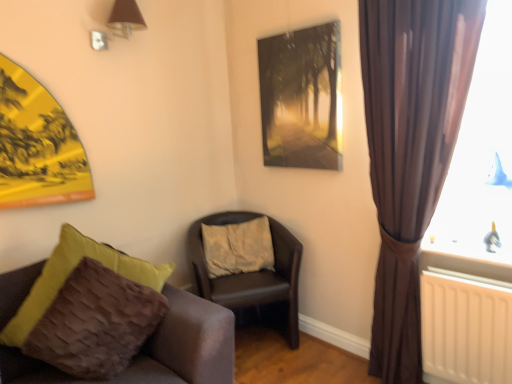
The width and height of the screenshot is (512, 384). What do you see at coordinates (125, 18) in the screenshot? I see `matte brown lampshade at upper left` at bounding box center [125, 18].

Measure the distance between matte brown lampshade at upper left and camera.

matte brown lampshade at upper left and camera are 2.14 meters apart from each other.

Where is `brown textured cushion at lower left, which is counted as the 1th chair, starting from the front`? The image size is (512, 384). brown textured cushion at lower left, which is counted as the 1th chair, starting from the front is located at coordinates (186, 344).

Where is `matte brown lampshade at upper left`? The image size is (512, 384). matte brown lampshade at upper left is located at coordinates (125, 18).

Which object is wider, beige fabric pillow at center or brown textured cushion at lower left, which appears as the 2th chair when viewed from the back?

brown textured cushion at lower left, which appears as the 2th chair when viewed from the back, is wider.

Between beige fabric pillow at center and brown textured cushion at lower left, which is counted as the 1th chair, starting from the front, which one has more height?

With more height is brown textured cushion at lower left, which is counted as the 1th chair, starting from the front.

From the image's perspective, relative to brown textured cushion at lower left, which appears as the 2th chair when viewed from the back, is beige fabric pillow at center above or below?

Based on their image positions, beige fabric pillow at center is located above brown textured cushion at lower left, which appears as the 2th chair when viewed from the back.

Which is more to the right, beige fabric pillow at center or brown textured cushion at lower left, which is counted as the 1th chair, starting from the front?

Positioned to the right is beige fabric pillow at center.

Is beige fabric pillow at center to the left of leather-like brown chair at center, which is the second chair from front to back, from the viewer's perspective?

Yes.

Considering the points (218, 248) and (272, 282), which point is in front, point (218, 248) or point (272, 282)?

Positioned in front is point (272, 282).

Would you consider beige fabric pillow at center to be distant from leather-like brown chair at center, arranged as the first chair when viewed from the back?

Actually, beige fabric pillow at center and leather-like brown chair at center, arranged as the first chair when viewed from the back, are a little close together.

Is beige fabric pillow at center bigger than leather-like brown chair at center, arranged as the first chair when viewed from the back?

Actually, beige fabric pillow at center might be smaller than leather-like brown chair at center, arranged as the first chair when viewed from the back.

Is brown satin curtain at right at the back of metallic silver picture frame at upper center?

That's not correct — metallic silver picture frame at upper center is not looking away from brown satin curtain at right.

From the image's perspective, which is above, metallic silver picture frame at upper center or brown satin curtain at right?

From the image's view, metallic silver picture frame at upper center is above.

Can you confirm if metallic silver picture frame at upper center is bigger than brown satin curtain at right?

No.

Who is shorter, metallic silver picture frame at upper center or brown satin curtain at right?

metallic silver picture frame at upper center is shorter.

Could you tell me if brown textured cushion at lower left, which appears as the 2th chair when viewed from the back, is facing metallic silver picture frame at upper center?

No, brown textured cushion at lower left, which appears as the 2th chair when viewed from the back, is not aimed at metallic silver picture frame at upper center.

From a real-world perspective, is brown textured cushion at lower left, which appears as the 2th chair when viewed from the back, positioned under metallic silver picture frame at upper center based on gravity?

Yes, from a real-world perspective, brown textured cushion at lower left, which appears as the 2th chair when viewed from the back, is beneath metallic silver picture frame at upper center.

Is brown textured cushion at lower left, which appears as the 2th chair when viewed from the back, wider than metallic silver picture frame at upper center?

Yes.

Is metallic silver picture frame at upper center surrounded by leather-like brown chair at center, which is the second chair from front to back?

No, metallic silver picture frame at upper center is located outside of leather-like brown chair at center, which is the second chair from front to back.

Between leather-like brown chair at center, which is the second chair from front to back, and metallic silver picture frame at upper center, which one has more height?

Standing taller between the two is leather-like brown chair at center, which is the second chair from front to back.

From the image's perspective, would you say leather-like brown chair at center, which is the second chair from front to back, is positioned over metallic silver picture frame at upper center?

No, from the image's perspective, leather-like brown chair at center, which is the second chair from front to back, is not above metallic silver picture frame at upper center.

Is metallic silver picture frame at upper center positioned with its back to leather-like brown chair at center, arranged as the first chair when viewed from the back?

That's not correct — metallic silver picture frame at upper center is not looking away from leather-like brown chair at center, arranged as the first chair when viewed from the back.

Who is taller, metallic silver picture frame at upper center or leather-like brown chair at center, arranged as the first chair when viewed from the back?

leather-like brown chair at center, arranged as the first chair when viewed from the back.

Is metallic silver picture frame at upper center located outside leather-like brown chair at center, arranged as the first chair when viewed from the back?

That's correct, metallic silver picture frame at upper center is outside of leather-like brown chair at center, arranged as the first chair when viewed from the back.

Considering the relative sizes of metallic silver picture frame at upper center and leather-like brown chair at center, arranged as the first chair when viewed from the back, in the image provided, is metallic silver picture frame at upper center wider than leather-like brown chair at center, arranged as the first chair when viewed from the back,?

No, metallic silver picture frame at upper center is not wider than leather-like brown chair at center, arranged as the first chair when viewed from the back.

Does brown satin curtain at right touch metallic silver picture frame at upper center?

No, brown satin curtain at right is not beside metallic silver picture frame at upper center.

Which is correct: brown satin curtain at right is inside metallic silver picture frame at upper center, or outside of it?

brown satin curtain at right exists outside the volume of metallic silver picture frame at upper center.

Does brown satin curtain at right have a smaller size compared to metallic silver picture frame at upper center?

Actually, brown satin curtain at right might be larger than metallic silver picture frame at upper center.

Consider the image. Is brown satin curtain at right oriented towards metallic silver picture frame at upper center?

No, brown satin curtain at right is not oriented towards metallic silver picture frame at upper center.

This screenshot has height=384, width=512. What are the coordinates of `pillow on the right of brown textured cushion at lower left, which appears as the 2th chair when viewed from the back` in the screenshot? It's located at (238, 247).

The image size is (512, 384). In order to click on pillow lying above the leather-like brown chair at center, arranged as the first chair when viewed from the back (from the image's perspective) in this screenshot , I will do `click(238, 247)`.

Based on their spatial positions, is leather-like brown chair at center, which is the second chair from front to back, or beige fabric pillow at center closer to metallic silver picture frame at upper center?

The object closer to metallic silver picture frame at upper center is beige fabric pillow at center.

When comparing their distances from brown textured cushion at lower left, which appears as the 2th chair when viewed from the back, does metallic silver picture frame at upper center or leather-like brown chair at center, which is the second chair from front to back, seem further?

metallic silver picture frame at upper center is positioned further to the anchor brown textured cushion at lower left, which appears as the 2th chair when viewed from the back.

Estimate the real-world distances between objects in this image. Which object is closer to beige fabric pillow at center, brown satin curtain at right or leather-like brown chair at center, arranged as the first chair when viewed from the back?

Based on the image, leather-like brown chair at center, arranged as the first chair when viewed from the back, appears to be nearer to beige fabric pillow at center.

Estimate the real-world distances between objects in this image. Which object is closer to leather-like brown chair at center, which is the second chair from front to back, brown satin curtain at right or matte brown lampshade at upper left?

Based on the image, brown satin curtain at right appears to be nearer to leather-like brown chair at center, which is the second chair from front to back.

Based on their spatial positions, is matte brown lampshade at upper left or beige fabric pillow at center closer to metallic silver picture frame at upper center?

Among the two, beige fabric pillow at center is located nearer to metallic silver picture frame at upper center.

When comparing their distances from matte brown lampshade at upper left, does beige fabric pillow at center or brown textured cushion at lower left, which is counted as the 1th chair, starting from the front, seem further?

beige fabric pillow at center is positioned further to the anchor matte brown lampshade at upper left.

Which object lies nearer to the anchor point brown textured cushion at lower left, which is counted as the 1th chair, starting from the front, leather-like brown chair at center, which is the second chair from front to back, or matte brown lampshade at upper left?

Among the two, leather-like brown chair at center, which is the second chair from front to back, is located nearer to brown textured cushion at lower left, which is counted as the 1th chair, starting from the front.

Based on their spatial positions, is brown satin curtain at right or leather-like brown chair at center, arranged as the first chair when viewed from the back, closer to matte brown lampshade at upper left?

Based on the image, leather-like brown chair at center, arranged as the first chair when viewed from the back, appears to be nearer to matte brown lampshade at upper left.

What are the coordinates of `pillow between matte brown lampshade at upper left and leather-like brown chair at center, arranged as the first chair when viewed from the back, in the up-down direction` in the screenshot? It's located at (238, 247).

This screenshot has width=512, height=384. Find the location of `picture frame between brown satin curtain at right and beige fabric pillow at center along the z-axis`. picture frame between brown satin curtain at right and beige fabric pillow at center along the z-axis is located at coordinates (302, 97).

Where is `pillow between brown textured cushion at lower left, which is counted as the 1th chair, starting from the front, and brown satin curtain at right, in the horizontal direction`? The image size is (512, 384). pillow between brown textured cushion at lower left, which is counted as the 1th chair, starting from the front, and brown satin curtain at right, in the horizontal direction is located at coordinates (238, 247).

Image resolution: width=512 pixels, height=384 pixels. Find the location of `chair located between brown satin curtain at right and beige fabric pillow at center in the depth direction`. chair located between brown satin curtain at right and beige fabric pillow at center in the depth direction is located at coordinates (252, 278).